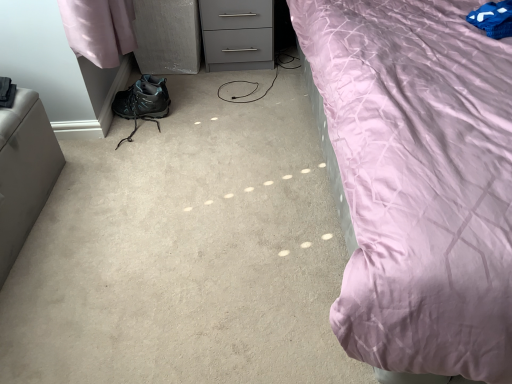
Question: Based on their sizes in the image, would you say gray matte chest of drawers at upper center is bigger or smaller than blue fabric pillow at upper right?

Choices:
 (A) big
 (B) small

Answer: (A)

Question: From the image's perspective, relative to blue fabric pillow at upper right, is gray matte chest of drawers at upper center above or below?

Choices:
 (A) below
 (B) above

Answer: (B)

Question: Which object is the closest to the gray matte chest of drawers at upper center?

Choices:
 (A) matte black hiking boot at lower left
 (B) matte black boot at lower left
 (C) blue fabric pillow at upper right
 (D) matte pink fabric at upper right
 (E) satin gray ottoman at left

Answer: (B)

Question: Based on their relative distances, which object is farther from the matte black boot at lower left?

Choices:
 (A) matte pink fabric at upper right
 (B) blue fabric pillow at upper right
 (C) gray matte chest of drawers at upper center
 (D) satin gray ottoman at left
 (E) matte black hiking boot at lower left

Answer: (B)